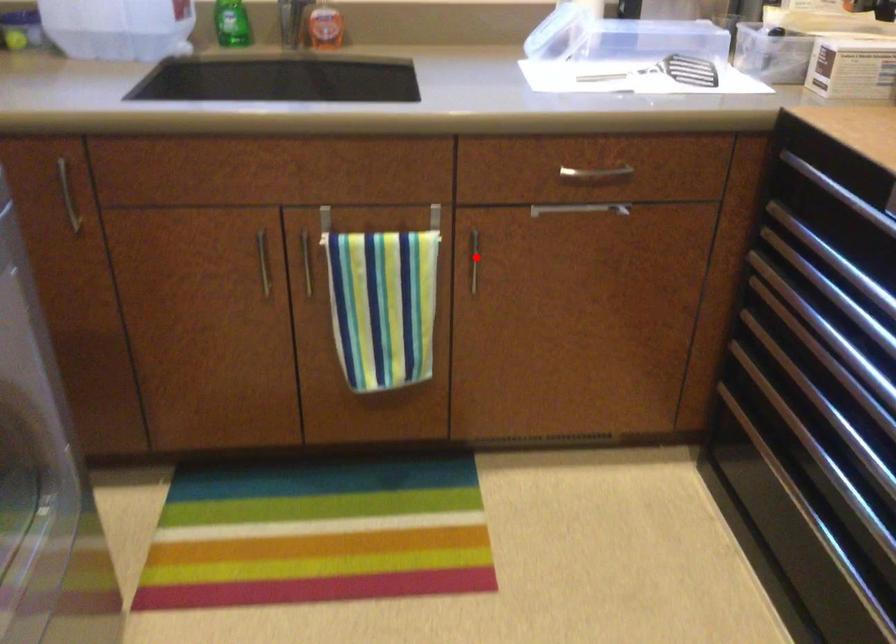
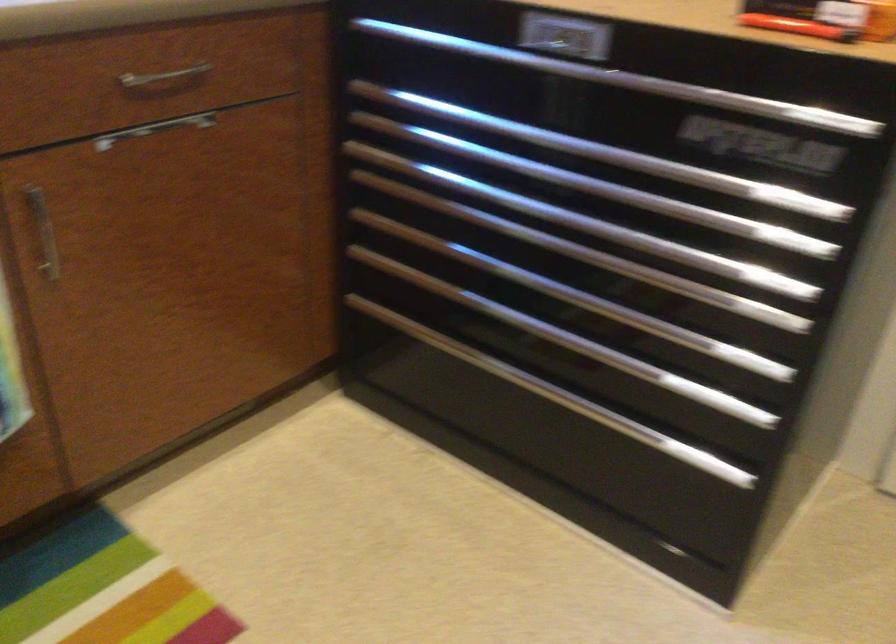
Locate, in the second image, the point that corresponds to the highlighted location in the first image.

(42, 232)